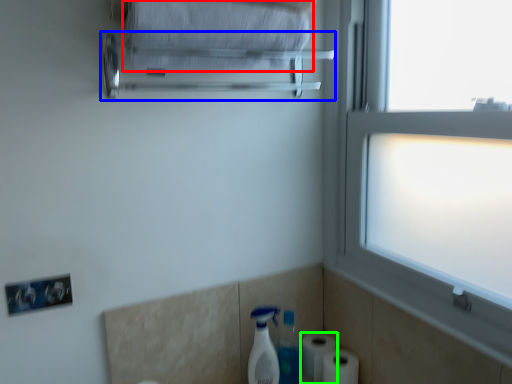
Question: Which object is positioned farthest from bath towel (highlighted by a red box)? Select from towel bar (highlighted by a blue box) and toilet paper (highlighted by a green box).

Choices:
 (A) towel bar
 (B) toilet paper

Answer: (B)